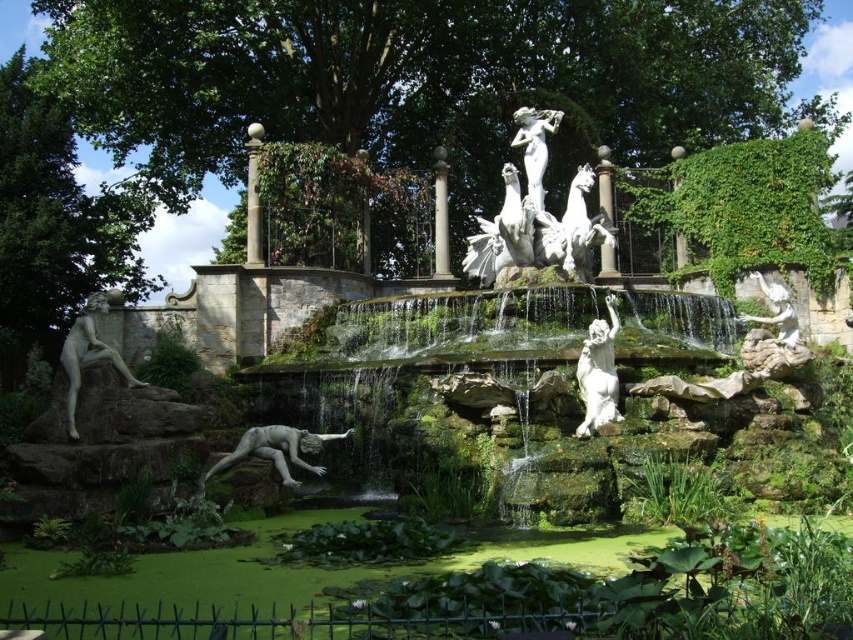
In the scene shown: How far apart are green mossy wall at upper right and white marble sculpture at center?

They are 16.35 meters apart.

Is green mossy wall at upper right smaller than white marble sculpture at center?

Yes, green mossy wall at upper right is smaller than white marble sculpture at center.

Which is behind, point (775, 250) or point (520, 218)?

Positioned behind is point (775, 250).

What are the coordinates of `green mossy wall at upper right` in the screenshot? It's located at pos(743,205).

Based on the photo, who is taller, smooth stone column at upper left or white marble pillar at center?

→ Standing taller between the two is smooth stone column at upper left.

Which is behind, point (254, 186) or point (602, 250)?

Positioned behind is point (602, 250).

You are a GUI agent. You are given a task and a screenshot of the screen. Output one action in this format:
    pyautogui.click(x=<x>, y=<y>)
    Task: Click on the smooth stone column at upper left
    The height and width of the screenshot is (640, 853).
    Given the screenshot: What is the action you would take?
    pyautogui.click(x=253, y=196)

Can you confirm if gray stone statue at lower center is positioned below white marble statue at upper center?

Yes.

Who is shorter, gray stone statue at lower center or white marble statue at upper center?

gray stone statue at lower center is shorter.

Describe the element at coordinates (274, 451) in the screenshot. I see `gray stone statue at lower center` at that location.

I want to click on gray stone statue at lower center, so click(274, 451).